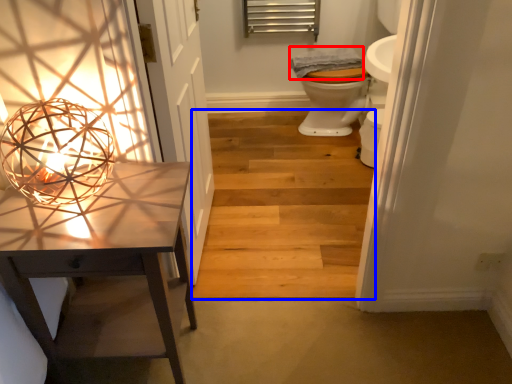
Question: Which object is further to the camera taking this photo, material (highlighted by a red box) or stairwell (highlighted by a blue box)?

Choices:
 (A) material
 (B) stairwell

Answer: (A)